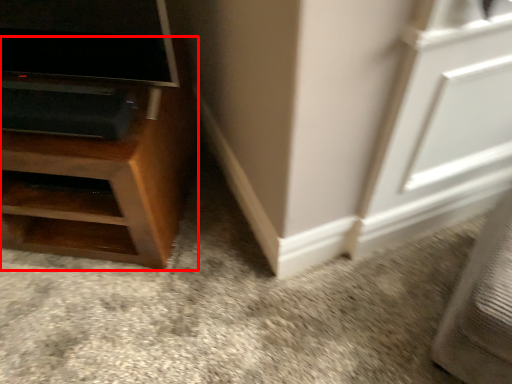
Question: Observing the image, what is the correct spatial positioning of furniture (annotated by the red box) in reference to screen door?

Choices:
 (A) left
 (B) right

Answer: (A)